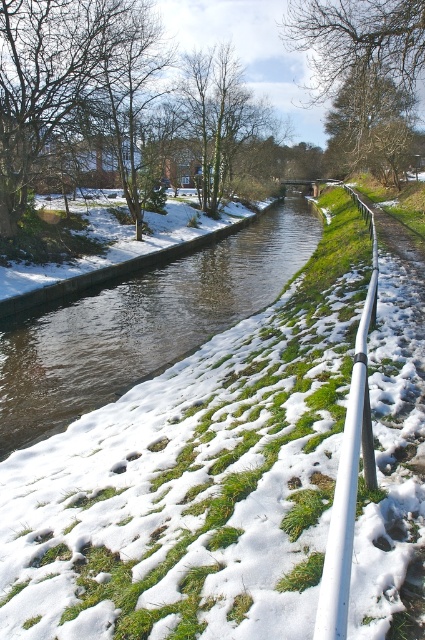
Question: Estimate the real-world distances between objects in this image. Which object is closer to the white metallic rail at right?

Choices:
 (A) brown leafless tree at upper center
 (B) smooth concrete canal at center

Answer: (B)

Question: Does brown leafless tree at upper center come in front of white metallic rail at right?

Choices:
 (A) no
 (B) yes

Answer: (A)

Question: Which object is positioned farthest from the white metallic rail at right?

Choices:
 (A) brown leafless tree at upper center
 (B) smooth concrete canal at center

Answer: (A)

Question: Is smooth concrete canal at center below brown leafless tree at upper center?

Choices:
 (A) yes
 (B) no

Answer: (A)

Question: Does brown leafless tree at upper center appear on the left side of white metallic rail at right?

Choices:
 (A) yes
 (B) no

Answer: (B)

Question: Which point is closer to the camera?

Choices:
 (A) white metallic rail at right
 (B) smooth concrete canal at center
 (C) brown leafless tree at upper center

Answer: (A)